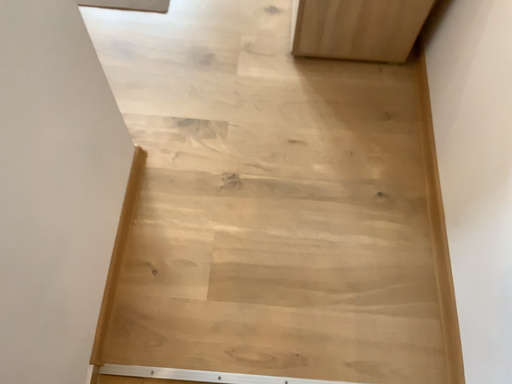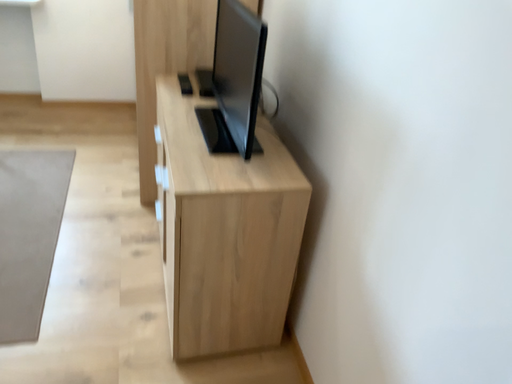
Question: How did the camera likely rotate when shooting the video?

Choices:
 (A) rotated downward
 (B) rotated upward

Answer: (B)